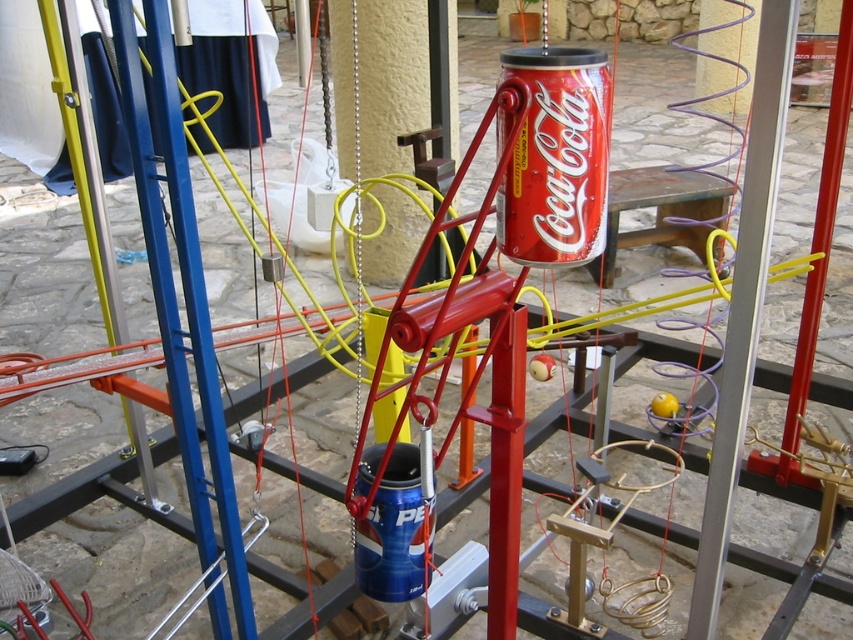
You are an engineer inspecting the mechanical structure. You need to determine which pole is shorter between the silver metallic pole at center and the blue metallic pole at left. Which one is shorter?

The silver metallic pole at center is shorter than the blue metallic pole at left.